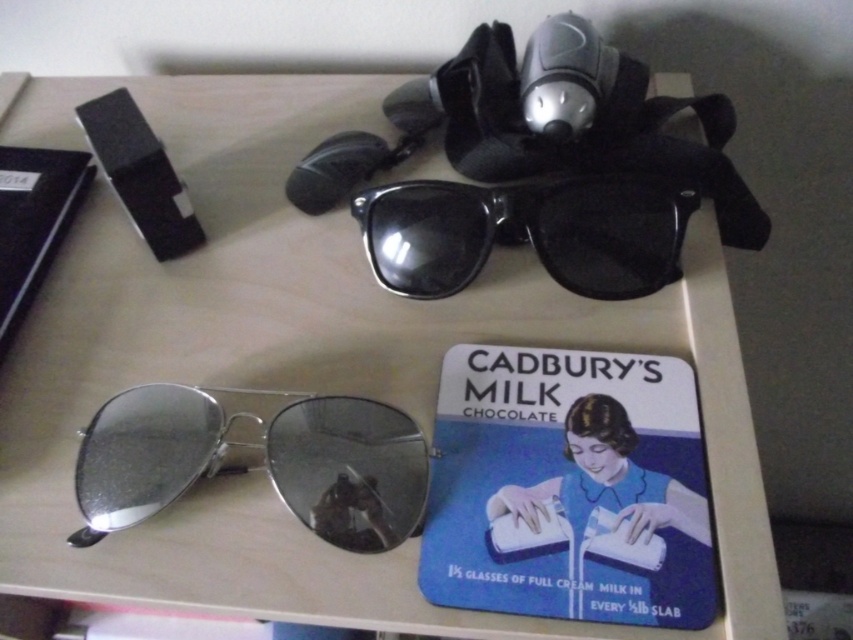
You are organizing items on a desk and need to place a small decorative item between the silver reflective aviator sunglasses at bottom left and the black plastic sunglasses at center. Considering their sizes, which sunglasses should the decorative item be closer to?

The silver reflective aviator sunglasses at bottom left is bigger than the black plastic sunglasses at center, so the decorative item should be placed closer to the smaller black plastic sunglasses at center to maintain balance.

You are organizing items on a desk and need to place a new item between the silver reflective aviator sunglasses at bottom left and the black plastic sunglasses at center. Is there enough space between them to fit a 2cm thick notebook?

The silver reflective aviator sunglasses at bottom left is positioned under the black plastic sunglasses at center, meaning they are stacked vertically. Since they are not side by side, there isn

You are organizing items on a desk and need to place a 25 cm wide decorative plate between the silver reflective aviator sunglasses at bottom left and the black plastic sunglasses at center. Can the plate fit in the space between them?

The distance between the silver reflective aviator sunglasses at bottom left and the black plastic sunglasses at center is 20.50 centimeters, which is shorter than the plate width of 25 cm. Therefore, the plate cannot fit between them.